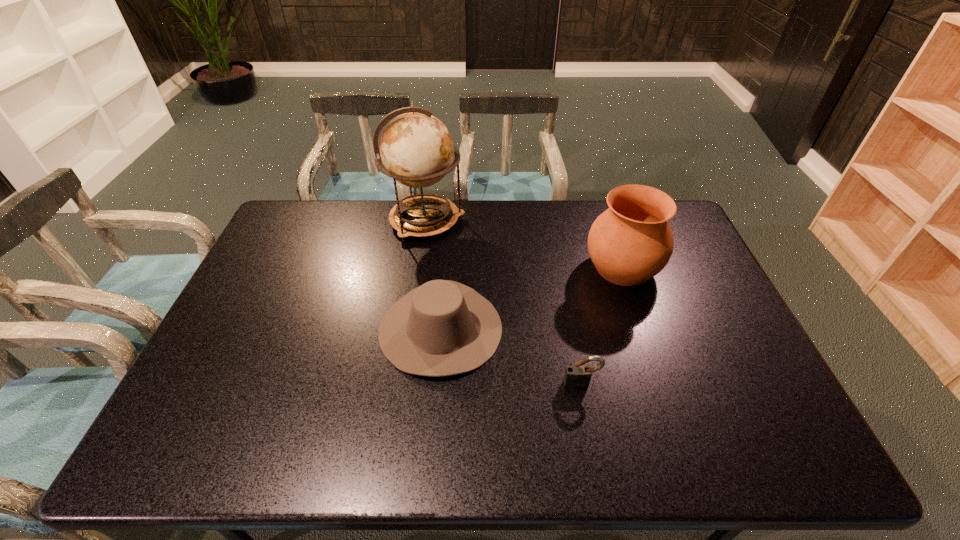
This screenshot has width=960, height=540. In order to click on vacant area that satisfies the following two spatial constraints: 1. on the back side of the pottery; 2. at the center of the tallest object in this screenshot , I will do `click(607, 221)`.

The image size is (960, 540). I want to click on vacant position in the image that satisfies the following two spatial constraints: 1. on the back side of the second tallest object; 2. at the center of the tallest object, so click(x=607, y=221).

What are the coordinates of `free space that satisfies the following two spatial constraints: 1. at the center of the cowboy hat; 2. on the right side of the tallest object` in the screenshot? It's located at (410, 328).

Find the location of `free region that satisfies the following two spatial constraints: 1. at the center of the tallest object; 2. on the left side of the second tallest object`. free region that satisfies the following two spatial constraints: 1. at the center of the tallest object; 2. on the left side of the second tallest object is located at coordinates (419, 268).